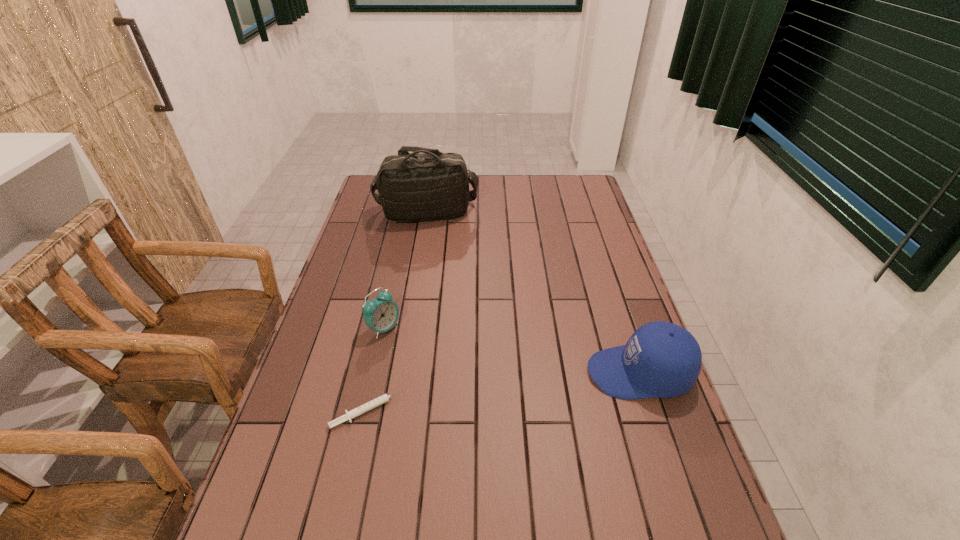
Identify the location of vacant space on the desktop that is between the syringe and the rightmost object and is positioned on the face of the alarm clock. This screenshot has width=960, height=540. (516, 390).

You are a GUI agent. You are given a task and a screenshot of the screen. Output one action in this format:
    pyautogui.click(x=<x>, y=<y>)
    Task: Click on the free spot on the desktop that is between the shortest object and the cap and is positioned at the front padded panel of the shoulder bag
    The image size is (960, 540).
    Given the screenshot: What is the action you would take?
    pyautogui.click(x=520, y=389)